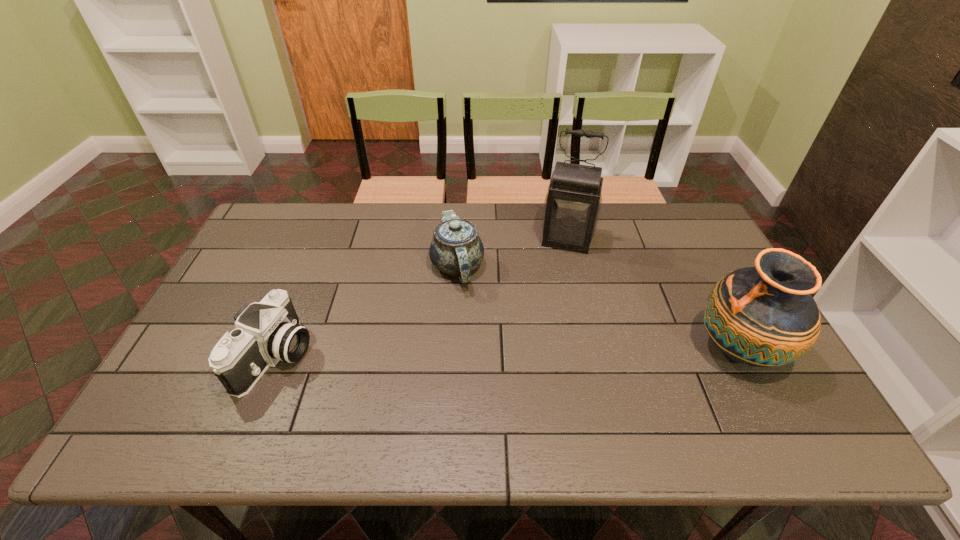
You are a GUI agent. You are given a task and a screenshot of the screen. Output one action in this format:
    pyautogui.click(x=<x>, y=<y>)
    Task: Click on the camera
    
    Given the screenshot: What is the action you would take?
    pyautogui.click(x=266, y=332)

Identify the location of the rightmost object. pyautogui.click(x=763, y=316).

You are a GUI agent. You are given a task and a screenshot of the screen. Output one action in this format:
    pyautogui.click(x=<x>, y=<y>)
    Task: Click on the pottery
    The image size is (960, 540).
    Given the screenshot: What is the action you would take?
    pyautogui.click(x=763, y=316)

Find the location of a particular element. The width and height of the screenshot is (960, 540). lantern is located at coordinates (572, 205).

This screenshot has height=540, width=960. I want to click on the third object from left to right, so click(572, 205).

In order to click on chinaware in this screenshot , I will do `click(456, 249)`.

Locate an element on the screen. free space located 0.200m on the back of the leftmost object is located at coordinates (312, 269).

Where is `vacant space located on the back of the pottery`? Image resolution: width=960 pixels, height=540 pixels. vacant space located on the back of the pottery is located at coordinates (681, 240).

Image resolution: width=960 pixels, height=540 pixels. Find the location of `free spot located on the front-facing side of the lantern`. free spot located on the front-facing side of the lantern is located at coordinates (543, 343).

I want to click on vacant space situated 0.280m on the front-facing side of the lantern, so click(549, 319).